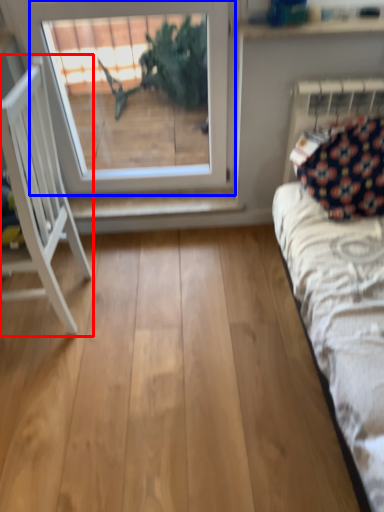
Question: Which of the following is the farthest to the observer, furniture (highlighted by a red box) or window (highlighted by a blue box)?

Choices:
 (A) furniture
 (B) window

Answer: (B)